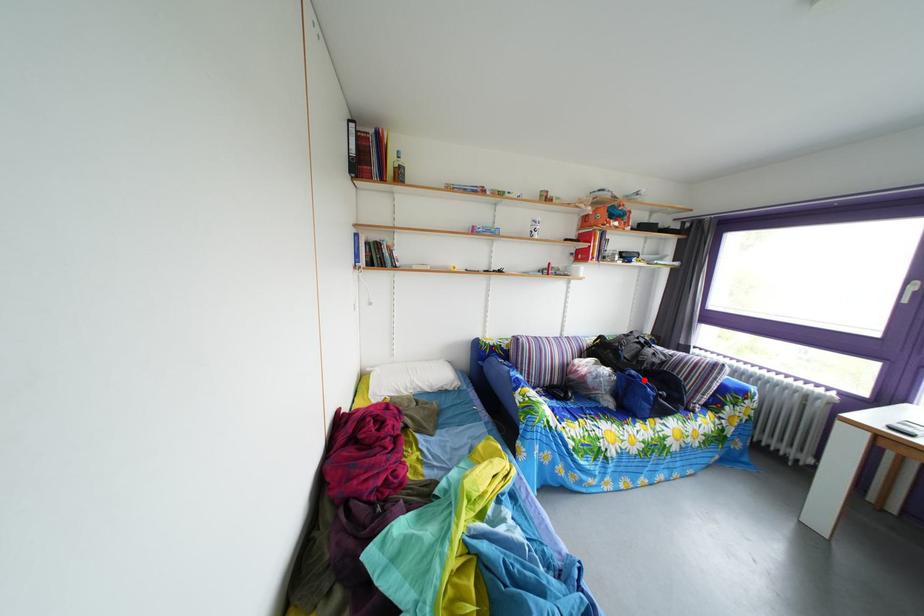
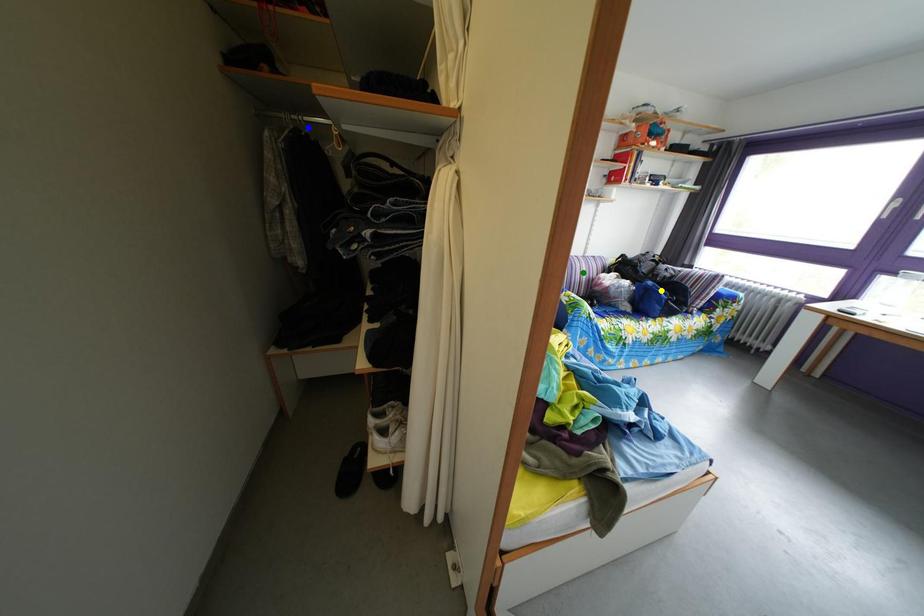
Question: I am providing you with two images of the same scene from different viewpoints. A red point is marked on the first image. You are given multiple points on the second image. Which spot in image 2 lines up with the point in image 1?

Choices:
 (A) blue point
 (B) yellow point
 (C) green point

Answer: (B)